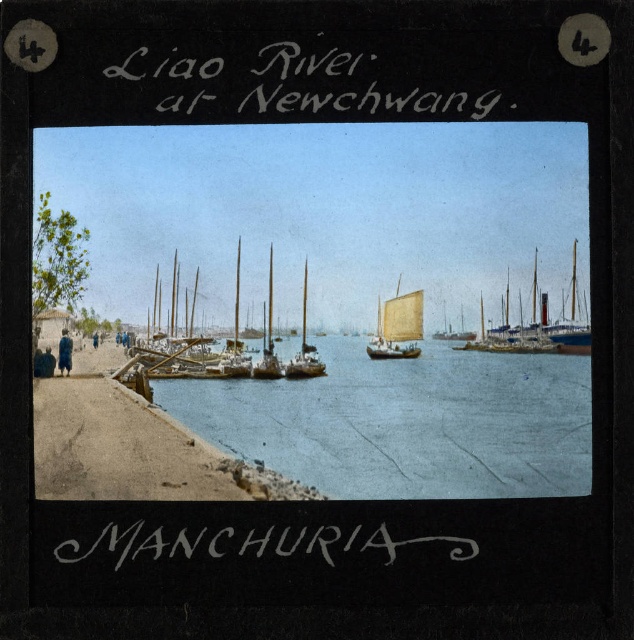
You are a photographer standing at the riverside and want to capture the white sailcloth sailboat at center in your shot. Since the blue water at center is directly below it, where should you aim your camera to include both the boat and the water?

You should aim your camera at the center of the scene to capture both the white sailcloth sailboat at center and the blue water at center since the blue water at center is positioned under the boat.

Consider the image. You are an observer looking at the vintage photograph of the Liao River at Newchwang. In the image, you see the blue water at center and the white sailcloth sailboat at center. Which of these two objects appears larger in height?

The blue water at center appears much taller than the white sailcloth sailboat at center in the vintage photograph.

You are a photographer planning to capture a wide shot of the blue water at center and the wooden sailboat at center from the shore. Considering the width of both objects, which one will occupy more space horizontally in your photo?

The blue water at center has a greater width than the wooden sailboat at center, so it will occupy more horizontal space in the photo.